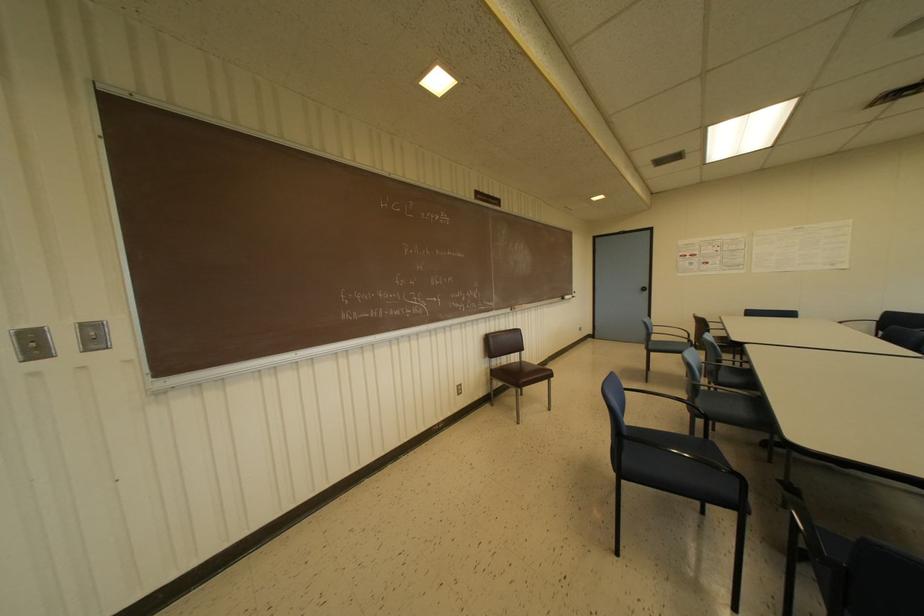
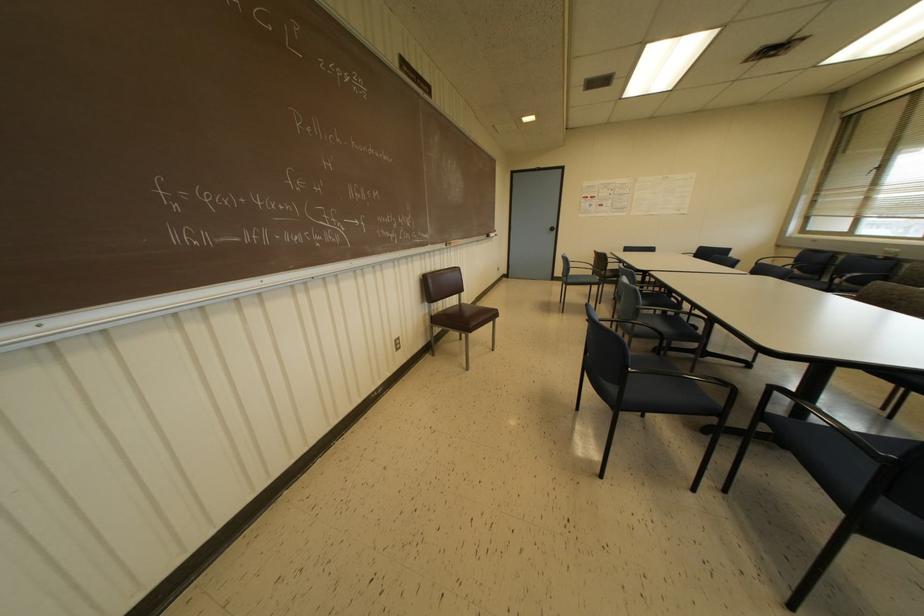
In a continuous first-person perspective shot, in which direction is the camera moving?

The cameraman moved toward left, forward.